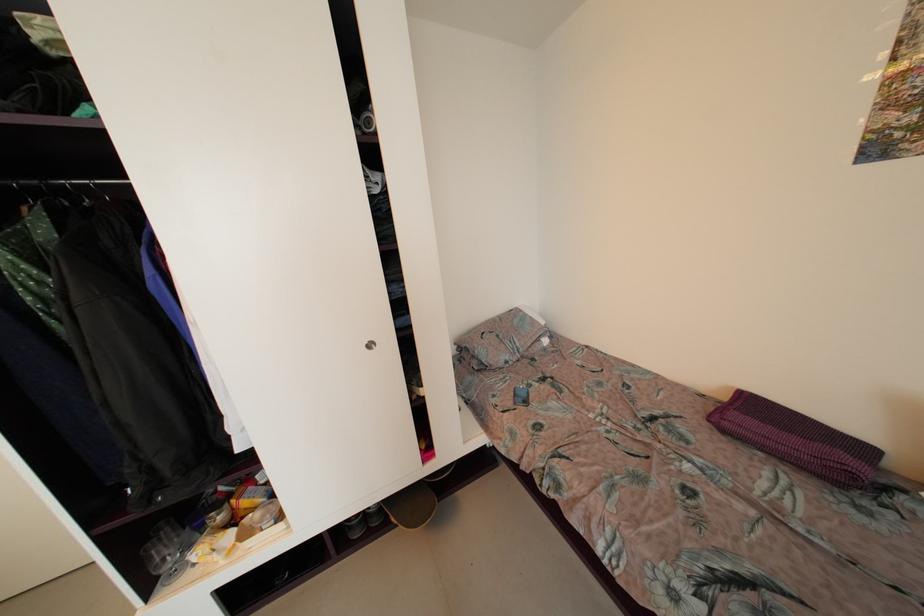
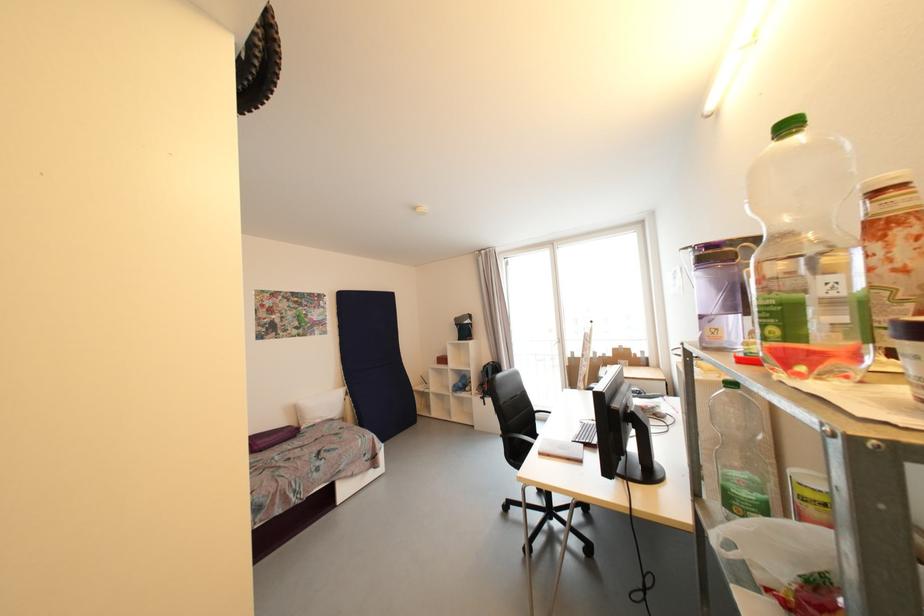
In the second image, find the point that corresponds to point (738, 416) in the first image.

(263, 445)